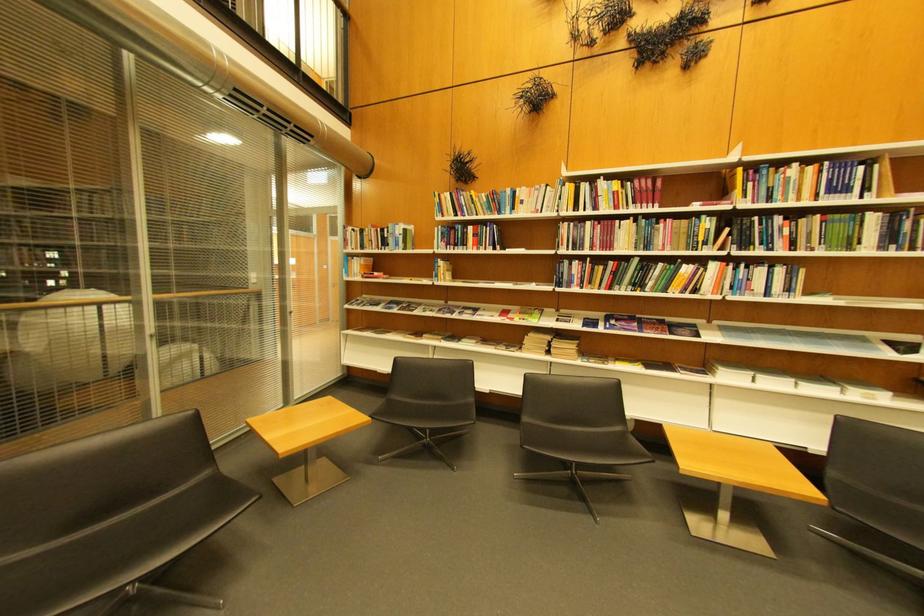
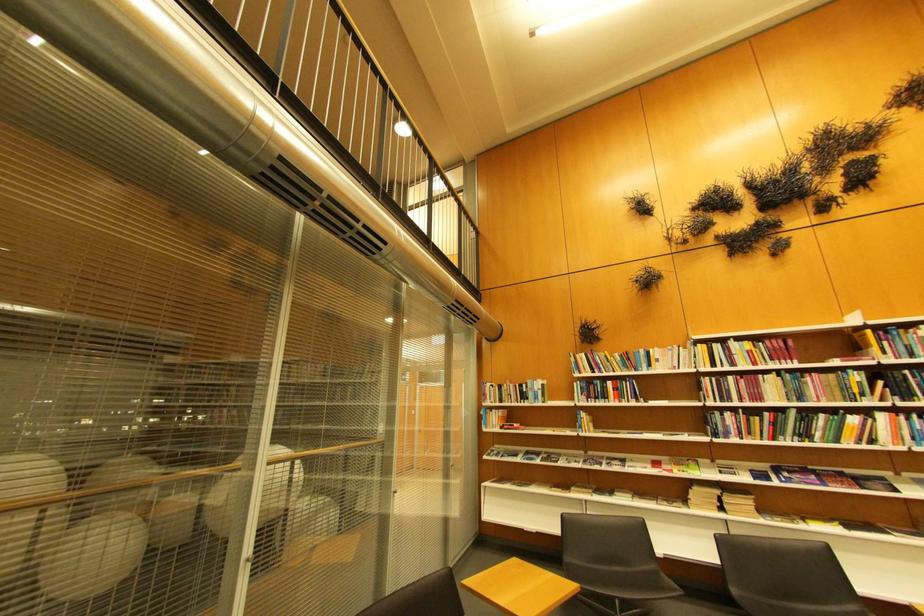
Based on the photo, the images are taken continuously from a first-person perspective. In which direction are you moving?

The cameraman moved toward left, backward.